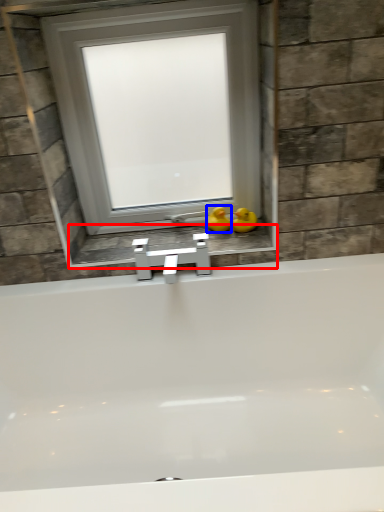
Question: Which of the following is the farthest to the observer, window sill (highlighted by a red box) or duck (highlighted by a blue box)?

Choices:
 (A) window sill
 (B) duck

Answer: (B)